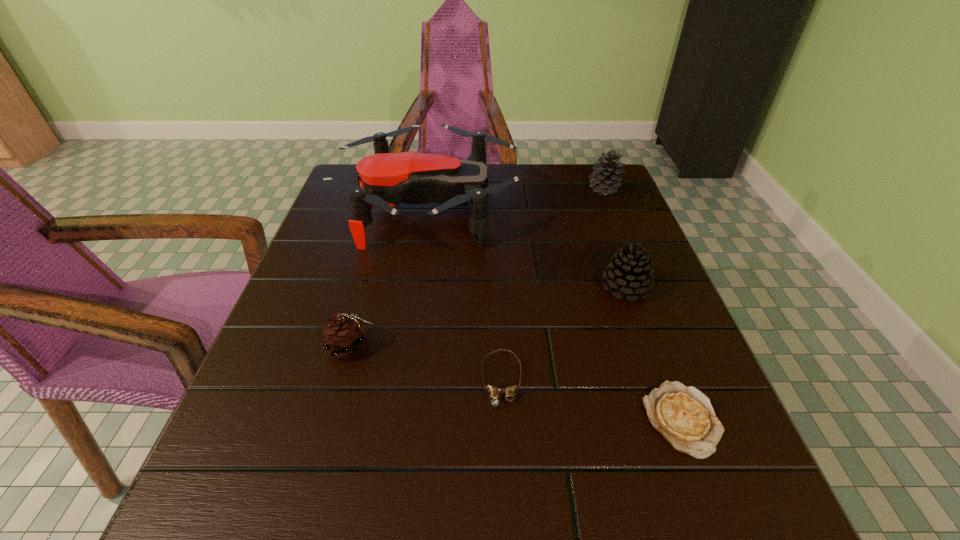
Image resolution: width=960 pixels, height=540 pixels. Find the location of `free space located with a leaf charm attached to the shortest pinecone`. free space located with a leaf charm attached to the shortest pinecone is located at coordinates (555, 347).

This screenshot has height=540, width=960. Find the location of `vacant space situated on the front lenses and sides of the goggles`. vacant space situated on the front lenses and sides of the goggles is located at coordinates (505, 466).

Where is `vacant space located 0.320m on the back of the quiche`? The image size is (960, 540). vacant space located 0.320m on the back of the quiche is located at coordinates coord(623,261).

The width and height of the screenshot is (960, 540). I want to click on drone situated at the far edge, so click(386, 179).

You are a GUI agent. You are given a task and a screenshot of the screen. Output one action in this format:
    pyautogui.click(x=<x>, y=<y>)
    Task: Click on the pinecone that is at the far edge
    
    Given the screenshot: What is the action you would take?
    pyautogui.click(x=605, y=181)

Image resolution: width=960 pixels, height=540 pixels. I want to click on drone positioned at the left edge, so click(386, 179).

Locate an element on the screen. pinecone that is at the left edge is located at coordinates (x=344, y=335).

What are the coordinates of `quiche situated at the right edge` in the screenshot? It's located at click(x=684, y=416).

Identify the location of object that is at the far left corner. The image size is (960, 540). (386, 179).

Locate an element on the screen. The height and width of the screenshot is (540, 960). object located at the far right corner is located at coordinates (605, 181).